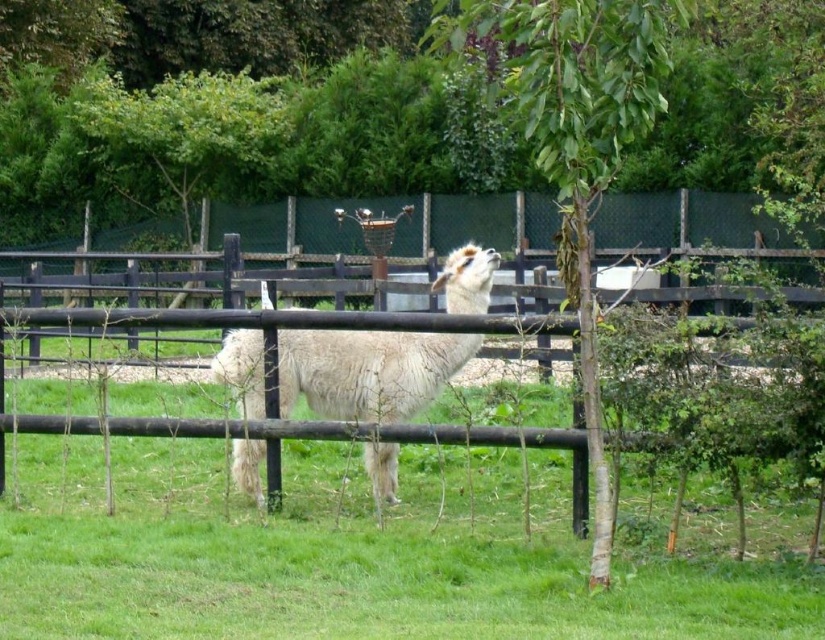
Is green grass at center further to camera compared to white woolly alpaca at center?

Yes, it is behind white woolly alpaca at center.

Is green grass at center shorter than white woolly alpaca at center?

Yes.

Who is more forward, (343, 579) or (462, 291)?

Point (343, 579)

Locate an element on the screen. The height and width of the screenshot is (640, 825). green grass at center is located at coordinates (333, 540).

Between point (352, 275) and point (384, 420), which one is positioned behind?

The point (352, 275) is more distant.

Based on the photo, is black wood fence at center positioned in front of white woolly alpaca at center?

Yes, it is.

Image resolution: width=825 pixels, height=640 pixels. What do you see at coordinates (304, 260) in the screenshot?
I see `black wood fence at center` at bounding box center [304, 260].

Where is `black wood fence at center`? black wood fence at center is located at coordinates (304, 260).

Which is more to the left, green leafy tree at center or white woolly alpaca at center?

Positioned to the left is white woolly alpaca at center.

Can you confirm if green leafy tree at center is wider than white woolly alpaca at center?

Yes.

In order to click on green leafy tree at center in this screenshot , I will do `click(574, 134)`.